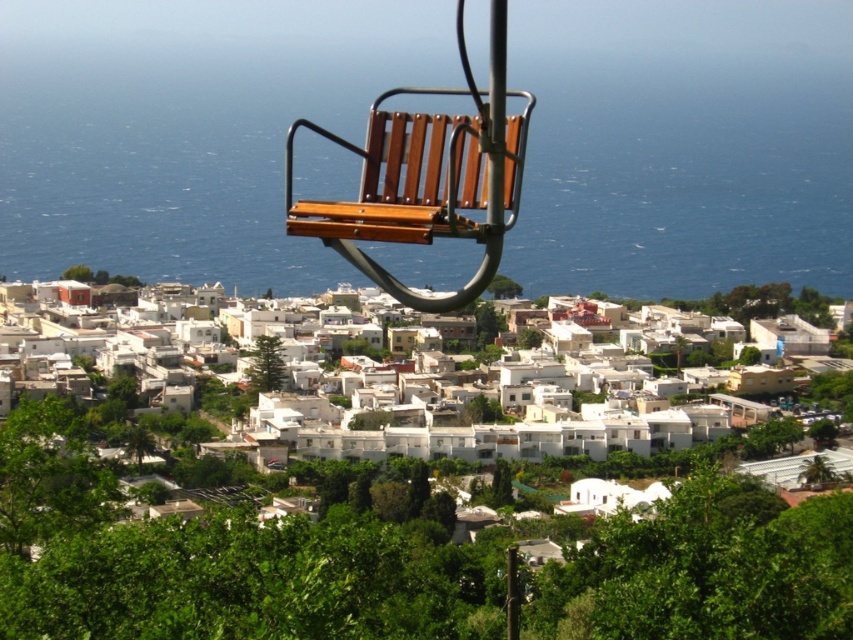
You are standing on the elevated chairlift and looking down at the coastal town. You notice the blue water at center and the white matte buildings at center. Which one is positioned to the right side from your viewpoint?

The blue water at center is to the right of the white matte buildings at center, so from your viewpoint on the chairlift, the blue water at center is positioned to the right side.

You are standing at the observation deck overlooking the coastal town. You notice a blue water at center and a wooden bench at center. Which object is closer to you?

The blue water at center is closer to you because it is further to the viewer than the wooden bench at center.

You are a tourist visiting the coastal town and want to take a photo that includes both the blue water at center and the white matte buildings at center. Based on the scene, which object will occupy more space in your photo?

The blue water at center is larger in size than the white matte buildings at center, so it will occupy more space in the photo.